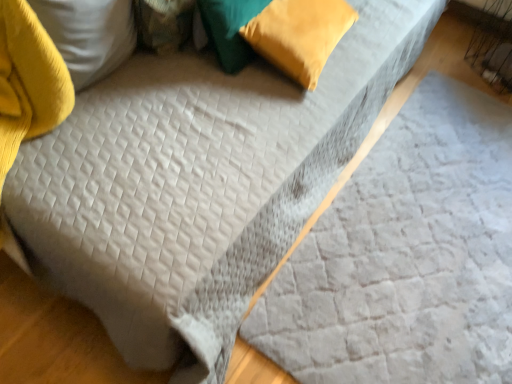
Question: From a real-world perspective, relative to gray quilted sheet at center, is velvet yellow pillow at upper right, the third pillow in the left-to-right sequence, vertically above or below?

Choices:
 (A) above
 (B) below

Answer: (A)

Question: From the image's perspective, is velvet yellow pillow at upper right, the third pillow in the left-to-right sequence, above or below gray quilted sheet at center?

Choices:
 (A) above
 (B) below

Answer: (A)

Question: Estimate the real-world distances between objects in this image. Which object is farther from the velvet yellow pillow at upper right, the third pillow in the left-to-right sequence?

Choices:
 (A) gray quilted sheet at center
 (B) velvet green pillow at upper left, which appears as the 1th pillow when viewed from the left
 (C) velvet green pillow at upper center, which ranks as the second pillow in right-to-left order

Answer: (A)

Question: Estimate the real-world distances between objects in this image. Which object is closer to the gray quilted sheet at center?

Choices:
 (A) velvet yellow pillow at upper right, marked as the 1th pillow in a right-to-left arrangement
 (B) velvet green pillow at upper left, which appears as the 1th pillow when viewed from the left
 (C) velvet green pillow at upper center, the second pillow positioned from the left

Answer: (A)